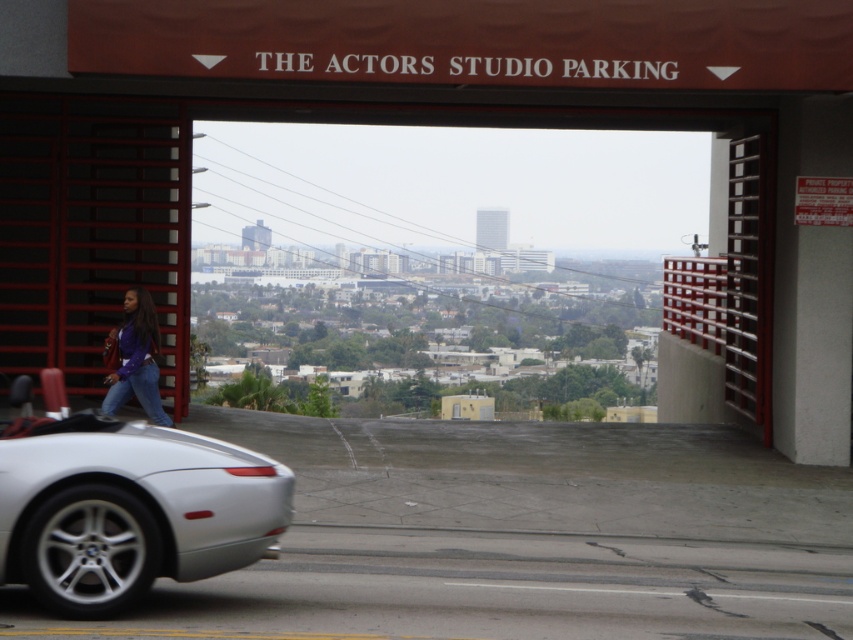
Does silver metallic car at lower left have a lesser width compared to matte purple shirt at center?

No.

Can you confirm if silver metallic car at lower left is positioned to the right of matte purple shirt at center?

Correct, you'll find silver metallic car at lower left to the right of matte purple shirt at center.

Is point (93, 416) positioned behind point (155, 412)?

No, it is not.

I want to click on silver metallic car at lower left, so click(125, 504).